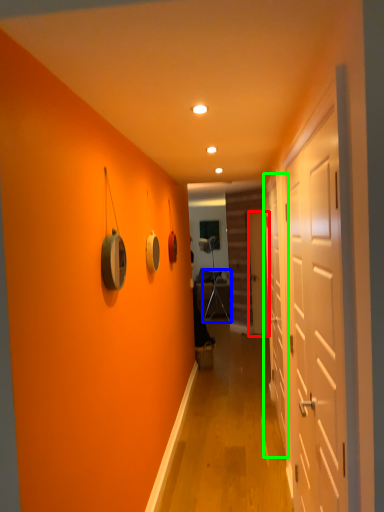
Question: Which object is the farthest from door (highlighted by a red box)? Choose among these: armchair (highlighted by a blue box) or door (highlighted by a green box).

Choices:
 (A) armchair
 (B) door

Answer: (B)